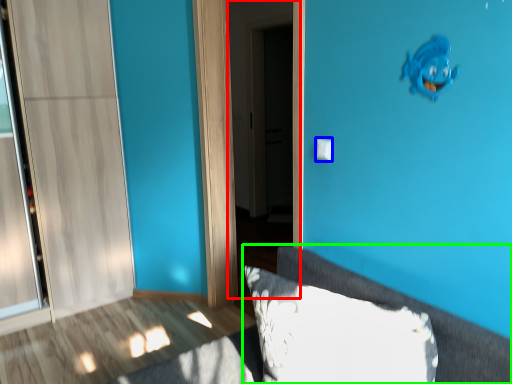
Question: Considering the real-world distances, which object is farthest from screen door (highlighted by a red box)? light switch (highlighted by a blue box) or furniture (highlighted by a green box)?

Choices:
 (A) light switch
 (B) furniture

Answer: (B)